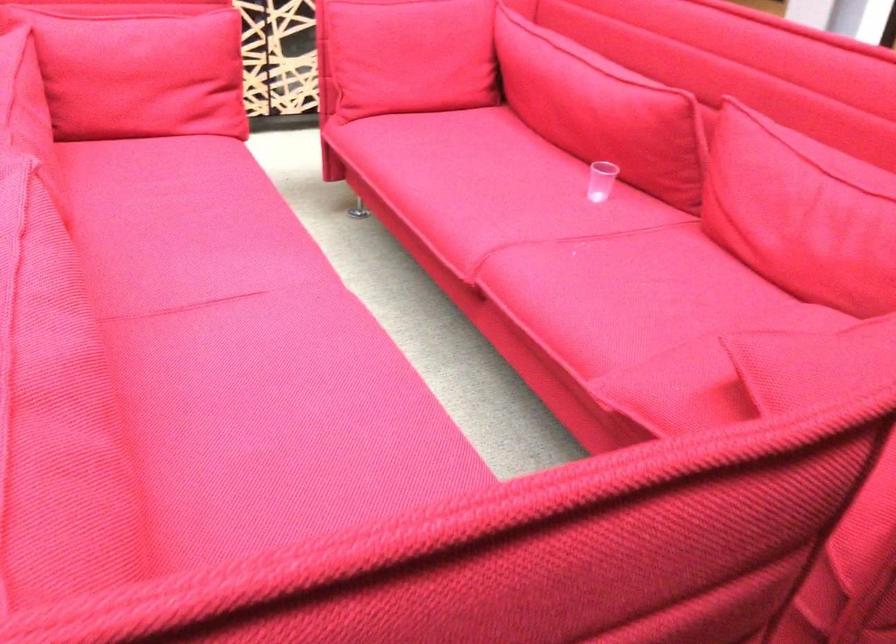
Which object does [600,180] point to?

This point indicates the clear plastic cup.